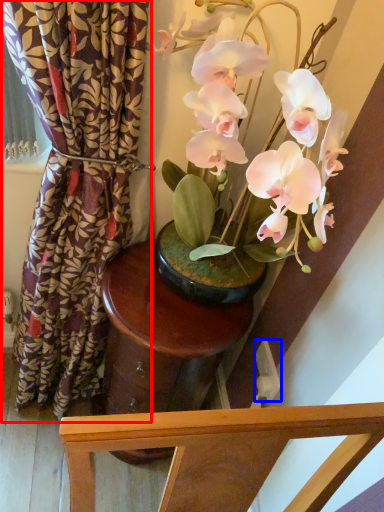
Question: Which object is closer to the camera taking this photo, curtain (highlighted by a red box) or power outlet (highlighted by a blue box)?

Choices:
 (A) curtain
 (B) power outlet

Answer: (A)